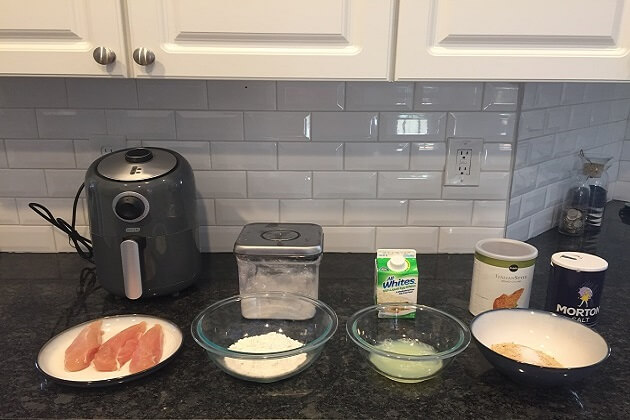
Locate an element on the screen. bowls with ingredients is located at coordinates (273, 354), (403, 351), (535, 358).